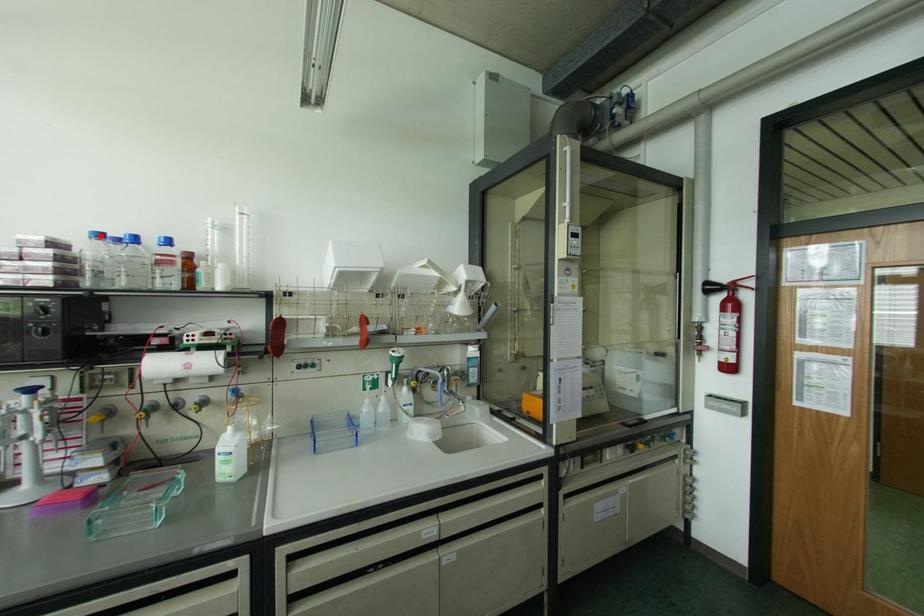
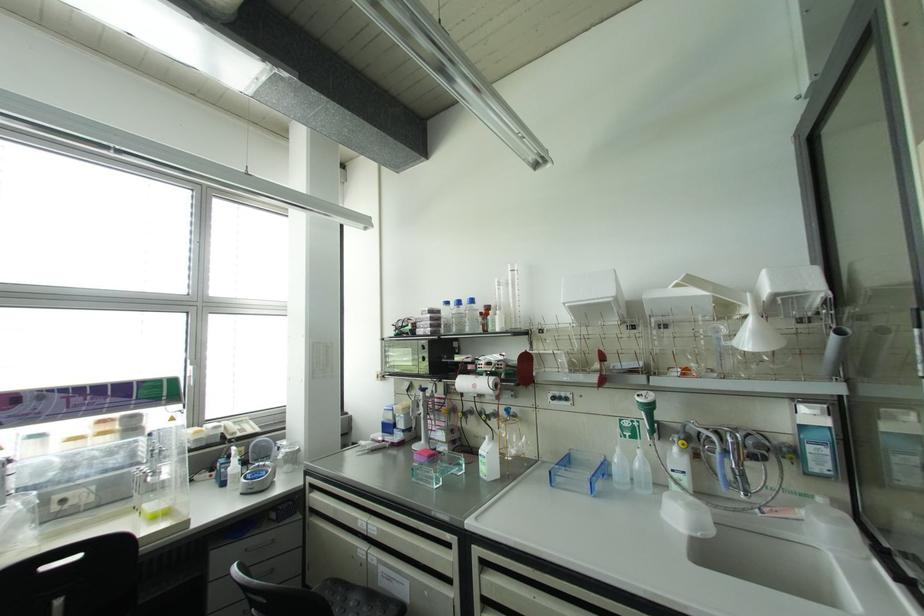
Where in the second image is the point corresponding to the highlighted location from the first image?

(446, 302)